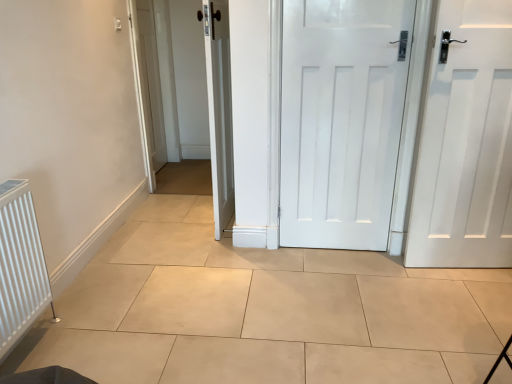
Question: Is white ribbed radiator at left far away from white matte door at right, which is the 1th door in right-to-left order?

Choices:
 (A) no
 (B) yes

Answer: (B)

Question: From a real-world perspective, is white ribbed radiator at left located higher than white matte door at right, which is the 1th door in right-to-left order?

Choices:
 (A) yes
 (B) no

Answer: (B)

Question: Can you confirm if white ribbed radiator at left is positioned to the left of white matte door at right, placed as the third door when sorted from left to right?

Choices:
 (A) no
 (B) yes

Answer: (B)

Question: Is white ribbed radiator at left at the right side of white matte door at right, which is the 1th door in right-to-left order?

Choices:
 (A) no
 (B) yes

Answer: (A)

Question: From the image's perspective, is white ribbed radiator at left below white matte door at right, placed as the third door when sorted from left to right?

Choices:
 (A) yes
 (B) no

Answer: (A)

Question: Is white ribbed radiator at left thinner than white matte door at right, which is the 1th door in right-to-left order?

Choices:
 (A) no
 (B) yes

Answer: (A)

Question: Is white matte door at center, marked as the second door in a left-to-right arrangement, located outside white ribbed radiator at left?

Choices:
 (A) no
 (B) yes

Answer: (B)

Question: Is white matte door at center, marked as the second door in a left-to-right arrangement, positioned far away from white ribbed radiator at left?

Choices:
 (A) no
 (B) yes

Answer: (B)

Question: Is white matte door at center, the 2th door from the right, turned away from white ribbed radiator at left?

Choices:
 (A) yes
 (B) no

Answer: (B)

Question: From the image's perspective, is white matte door at center, the 2th door from the right, located beneath white ribbed radiator at left?

Choices:
 (A) no
 (B) yes

Answer: (A)

Question: Is white matte door at center, marked as the second door in a left-to-right arrangement, wider than white ribbed radiator at left?

Choices:
 (A) no
 (B) yes

Answer: (A)

Question: Considering the relative positions of white matte door at center, marked as the second door in a left-to-right arrangement, and white ribbed radiator at left in the image provided, is white matte door at center, marked as the second door in a left-to-right arrangement, to the left of white ribbed radiator at left from the viewer's perspective?

Choices:
 (A) no
 (B) yes

Answer: (A)

Question: From a real-world perspective, does white matte door at center, marked as the second door in a left-to-right arrangement, stand above white matte door at right, which is the 1th door in right-to-left order?

Choices:
 (A) yes
 (B) no

Answer: (A)